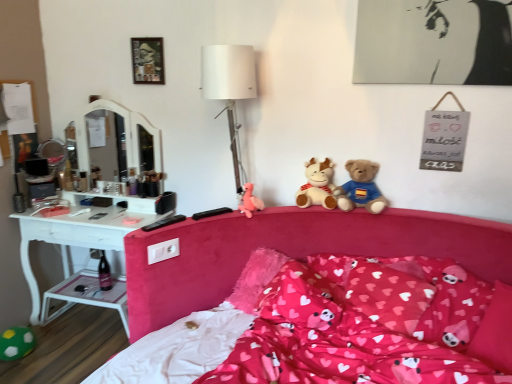
Question: From the image's perspective, relative to soft plush teddy bear at center, is green fuzzy ball at lower left, the 1th toy ordered from the bottom, above or below?

Choices:
 (A) above
 (B) below

Answer: (B)

Question: From a real-world perspective, relative to soft plush teddy bear at center, is green fuzzy ball at lower left, acting as the first toy starting from the left, vertically above or below?

Choices:
 (A) below
 (B) above

Answer: (A)

Question: Estimate the real-world distances between objects in this image. Which object is closer to the soft plush teddy bear at center?

Choices:
 (A) green fuzzy ball at lower left, positioned as the 3th toy in right-to-left order
 (B) pink fluffy pillow at center, which is the 3th pillow from left to right
 (C) velvet pink bed at center
 (D) metallic silver picture frame at upper center
 (E) fluffy pink pillow at center, the third pillow from the right

Answer: (C)

Question: Which object is the farthest from the velvet pink bed at center?

Choices:
 (A) fluffy pink pillow at center, which appears as the first pillow when viewed from the left
 (B) pink fluffy pillow at center, which is the 3th pillow from left to right
 (C) white plastic side table at lower left
 (D) green fuzzy ball at lower left, arranged as the third toy when viewed from the top
 (E) soft plush teddy bear at center

Answer: (D)